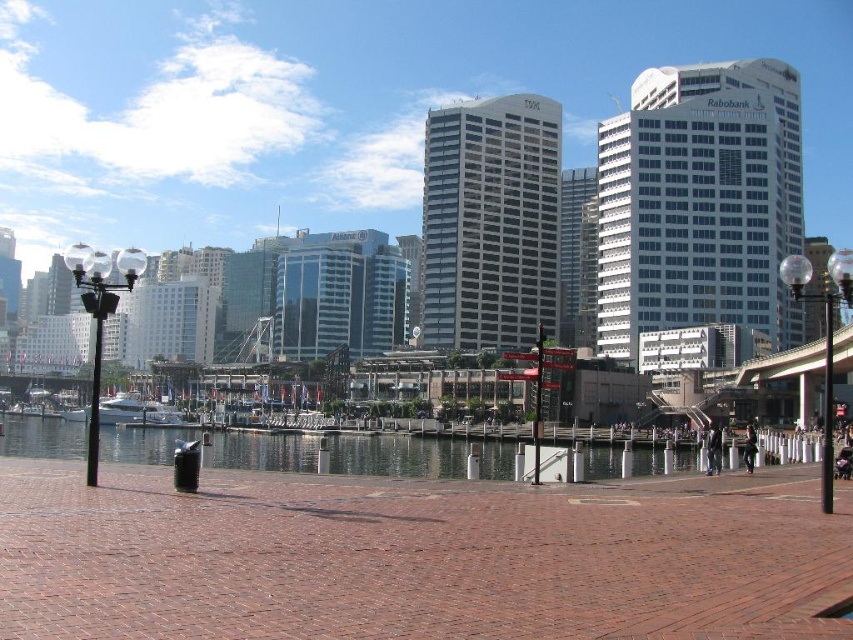
Question: Which object is closer to the camera taking this photo?

Choices:
 (A) clear water at center
 (B) white glossy boat at center

Answer: (A)

Question: Is clear water at center to the left of white glossy boat at center from the viewer's perspective?

Choices:
 (A) no
 (B) yes

Answer: (A)

Question: Does clear water at center have a smaller size compared to white glossy boat at center?

Choices:
 (A) yes
 (B) no

Answer: (B)

Question: Considering the relative positions of clear water at center and white glossy boat at center in the image provided, where is clear water at center located with respect to white glossy boat at center?

Choices:
 (A) left
 (B) right

Answer: (B)

Question: Among these points, which one is farthest from the camera?

Choices:
 (A) (254, 461)
 (B) (103, 397)

Answer: (B)